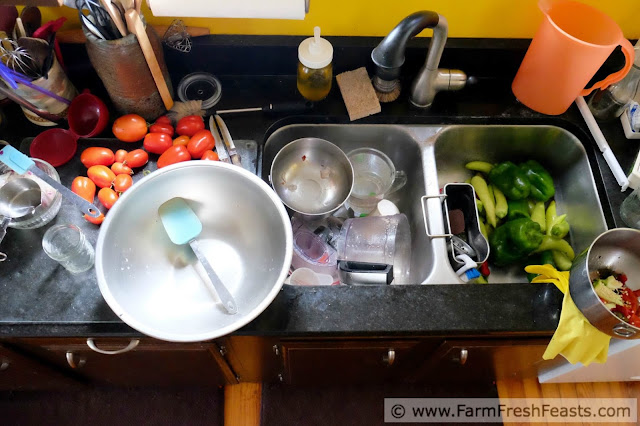
Find the location of a particular element. The width and height of the screenshot is (640, 426). dish soap is located at coordinates (313, 79).